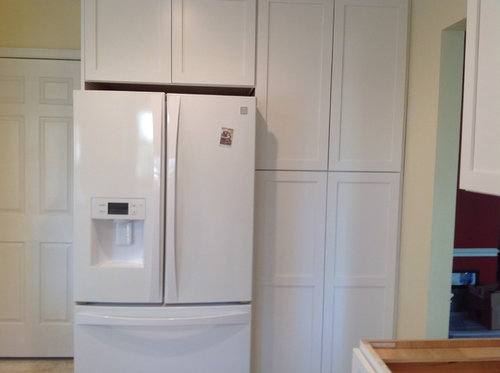
Locate an element on the screen. This screenshot has height=373, width=500. counter is located at coordinates (434, 359).